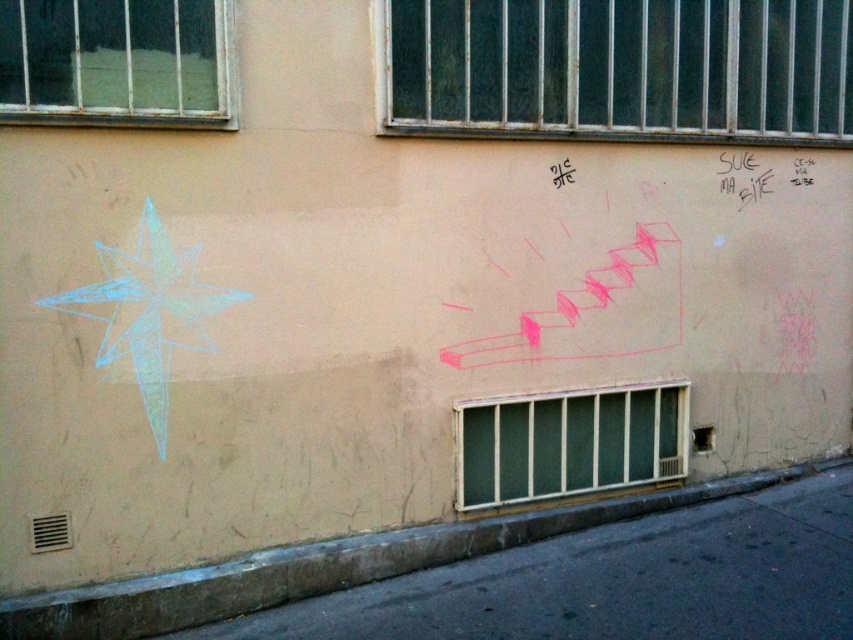
You are standing in front of the beige building with the graffiti. There are two points marked on the wall. The first point is at coordinates point (154, 426) and the second is at point (740, 173). Which point is closer to you?

Point (154, 426) is closer to the viewer than point (740, 173).

You are standing in front of a beige building with two windows and a vent. You notice two chalk drawings on the wall. One is a blue chalk star at upper left and the other is a black chalk graffiti at upper right. Which of these two chalk drawings is positioned higher on the wall?

The black chalk graffiti at upper right is positioned higher on the wall than the blue chalk star at upper left.